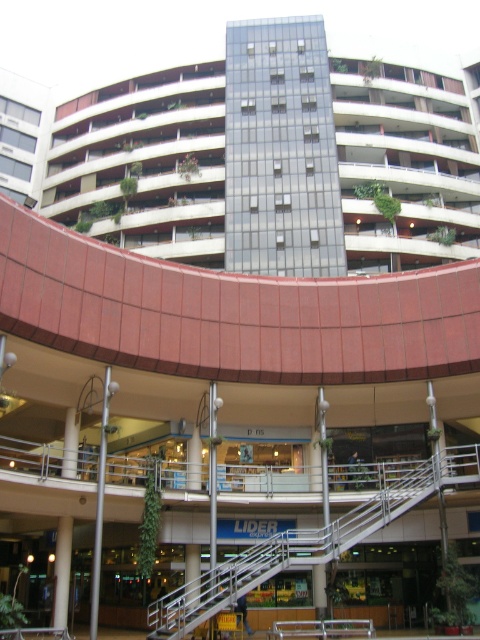
Between metallic staircase at center and metallic silver staircase at center, which one appears on the right side from the viewer's perspective?

Positioned to the right is metallic staircase at center.

Between metallic staircase at center and metallic silver staircase at center, which one is positioned higher?

metallic staircase at center is above.

Is point (183, 596) positioned behind point (254, 573)?

That is True.

The height and width of the screenshot is (640, 480). What are the coordinates of `metallic staircase at center` in the screenshot? It's located at (305, 545).

Which is more to the right, glassy concrete building at center or metallic staircase at center?

metallic staircase at center is more to the right.

Does glassy concrete building at center lie behind metallic staircase at center?

Yes, it is.

Who is more distant from viewer, (203, 252) or (202, 614)?

The point (203, 252) is behind.

You are a GUI agent. You are given a task and a screenshot of the screen. Output one action in this format:
    pyautogui.click(x=<x>, y=<y>)
    Task: Click on the glassy concrete building at center
    Image resolution: width=480 pixels, height=640 pixels.
    Given the screenshot: What is the action you would take?
    pyautogui.click(x=262, y=154)

Can you confirm if glassy concrete building at center is smaller than metallic silver staircase at center?

No, glassy concrete building at center is not smaller than metallic silver staircase at center.

Image resolution: width=480 pixels, height=640 pixels. Describe the element at coordinates (262, 154) in the screenshot. I see `glassy concrete building at center` at that location.

Identify the location of glassy concrete building at center. This screenshot has width=480, height=640. (262, 154).